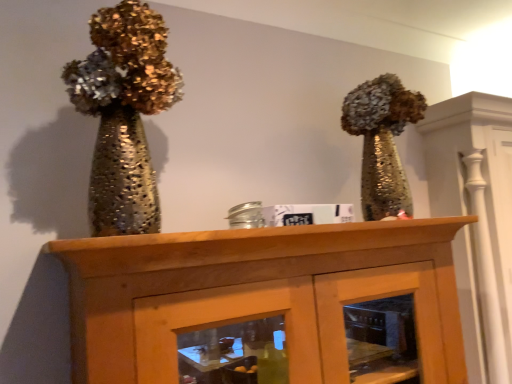
This screenshot has width=512, height=384. What do you see at coordinates (258, 294) in the screenshot?
I see `wooden cabinet at center` at bounding box center [258, 294].

Where is `wooden cabinet at center`? The width and height of the screenshot is (512, 384). wooden cabinet at center is located at coordinates (258, 294).

Where is `shiny metallic vase at left`? The image size is (512, 384). shiny metallic vase at left is located at coordinates (123, 113).

What do you see at coordinates (123, 113) in the screenshot? I see `shiny metallic vase at left` at bounding box center [123, 113].

The image size is (512, 384). I want to click on wooden cabinet at center, so click(x=258, y=294).

Considering the relative positions of wooden cabinet at center and shiny metallic vase at left in the image provided, is wooden cabinet at center to the left of shiny metallic vase at left from the viewer's perspective?

Incorrect, wooden cabinet at center is not on the left side of shiny metallic vase at left.

Does wooden cabinet at center lie behind shiny metallic vase at left?

No, it is not.

Which is less distant, (288,327) or (141,4)?

Point (288,327) is farther from the camera than point (141,4).

From the image's perspective, is wooden cabinet at center over shiny metallic vase at left?

Incorrect, from the image's perspective, wooden cabinet at center is lower than shiny metallic vase at left.

From a real-world perspective, does wooden cabinet at center stand above shiny metallic vase at left?

No, from a real-world perspective, wooden cabinet at center is not above shiny metallic vase at left.

Looking at their sizes, would you say wooden cabinet at center is wider or thinner than shiny metallic vase at left?

Considering their sizes, wooden cabinet at center looks broader than shiny metallic vase at left.

Considering the sizes of objects wooden cabinet at center and shiny metallic vase at left in the image provided, who is taller, wooden cabinet at center or shiny metallic vase at left?

wooden cabinet at center.

From the picture: Can you confirm if wooden cabinet at center is smaller than shiny metallic vase at left?

No.

Which is correct: wooden cabinet at center is inside shiny metallic vase at left, or outside of it?

Answer: The correct answer is: outside.

Is wooden cabinet at center placed right next to shiny metallic vase at left?

They are not placed beside each other.

Could you tell me if wooden cabinet at center is facing shiny metallic vase at left?

Answer: No, wooden cabinet at center is not oriented towards shiny metallic vase at left.

The width and height of the screenshot is (512, 384). Identify the location of floral arrangement lying on the left of wooden cabinet at center. (123, 113).

Which object is positioned more to the left, shiny metallic vase at left or wooden cabinet at center?

Positioned to the left is shiny metallic vase at left.

Relative to wooden cabinet at center, is shiny metallic vase at left in front or behind?

Clearly, shiny metallic vase at left is behind wooden cabinet at center.

Is point (101, 218) closer to camera compared to point (194, 315)?

That is False.

From the image's perspective, is shiny metallic vase at left positioned above or below wooden cabinet at center?

From the image's perspective, shiny metallic vase at left appears above wooden cabinet at center.

From a real-world perspective, relative to wooden cabinet at center, is shiny metallic vase at left vertically above or below?

shiny metallic vase at left is above wooden cabinet at center.

Considering the sizes of objects shiny metallic vase at left and wooden cabinet at center in the image provided, who is thinner, shiny metallic vase at left or wooden cabinet at center?

shiny metallic vase at left.

Is shiny metallic vase at left taller than wooden cabinet at center?

In fact, shiny metallic vase at left may be shorter than wooden cabinet at center.

Considering the relative sizes of shiny metallic vase at left and wooden cabinet at center in the image provided, is shiny metallic vase at left bigger than wooden cabinet at center?

Actually, shiny metallic vase at left might be smaller than wooden cabinet at center.

Is shiny metallic vase at left located outside wooden cabinet at center?

shiny metallic vase at left is positioned outside wooden cabinet at center.

Are shiny metallic vase at left and wooden cabinet at center far apart?

That's not correct — shiny metallic vase at left is a little close to wooden cabinet at center.

Is wooden cabinet at center at the back of shiny metallic vase at left?

No, wooden cabinet at center is not at the back of shiny metallic vase at left.

This screenshot has width=512, height=384. I want to click on furniture below the shiny metallic vase at left (from the image's perspective), so click(258, 294).

In the image, there is a shiny metallic vase at left. Identify the location of furniture below it (from the image's perspective). (258, 294).

The image size is (512, 384). I want to click on furniture that appears in front of the shiny metallic vase at left, so click(x=258, y=294).